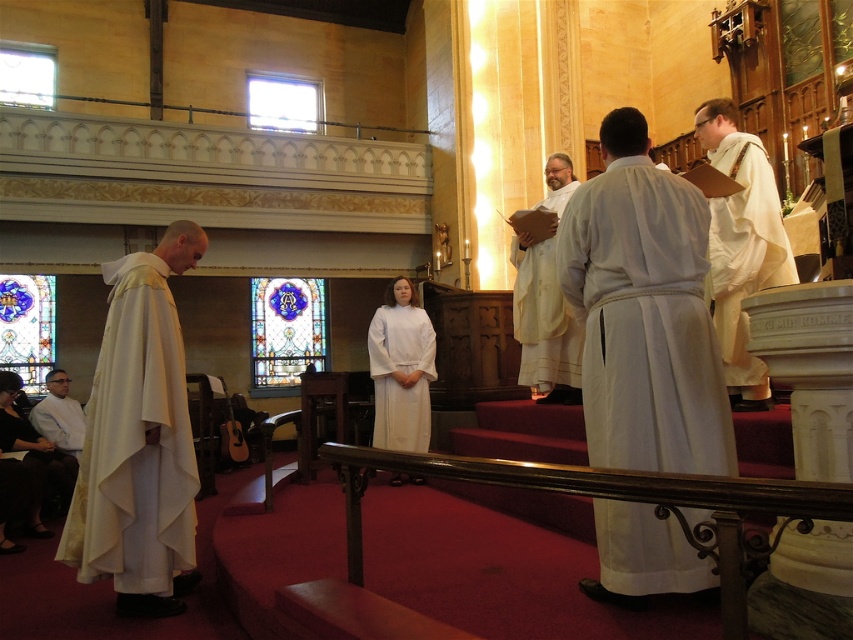
Question: Is white cloth robe at center to the right of white matte robe at left from the viewer's perspective?

Choices:
 (A) no
 (B) yes

Answer: (B)

Question: Which point appears farthest from the camera in this image?

Choices:
 (A) (x=108, y=262)
 (B) (x=27, y=323)
 (C) (x=413, y=321)
 (D) (x=64, y=420)

Answer: (B)

Question: Is white cloth robe at center to the left of stained glass window at center from the viewer's perspective?

Choices:
 (A) yes
 (B) no

Answer: (B)

Question: Observing the image, what is the correct spatial positioning of white matte robe at upper right in reference to stained glass window at left?

Choices:
 (A) right
 (B) left

Answer: (A)

Question: Which point appears farthest from the camera in this image?

Choices:
 (A) (32, 348)
 (B) (573, 280)
 (C) (161, 513)

Answer: (A)

Question: Which point is closer to the camera taking this photo?

Choices:
 (A) (74, 477)
 (B) (61, 422)

Answer: (A)